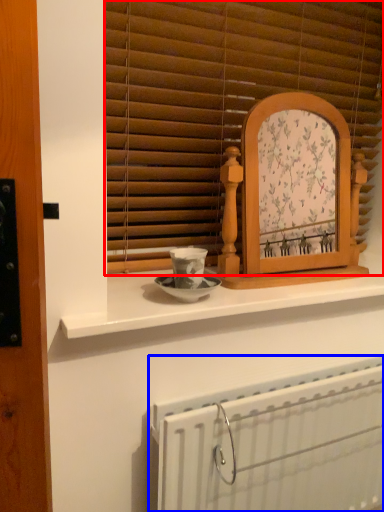
Question: Which of the following is the farthest to the observer, window blind (highlighted by a red box) or radiator (highlighted by a blue box)?

Choices:
 (A) window blind
 (B) radiator

Answer: (A)